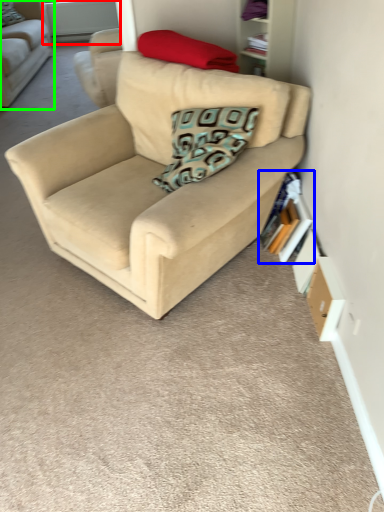
Question: Based on their relative distances, which object is farther from window screen (highlighted by a red box)? Choose from book (highlighted by a blue box) and studio couch (highlighted by a green box).

Choices:
 (A) book
 (B) studio couch

Answer: (A)